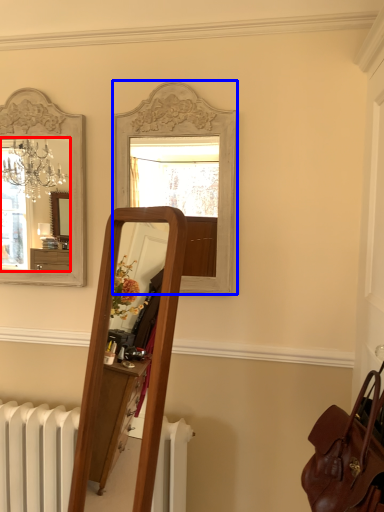
Question: Among these objects, which one is nearest to the camera, mirror (highlighted by a red box) or mirror (highlighted by a blue box)?

Choices:
 (A) mirror
 (B) mirror

Answer: (B)